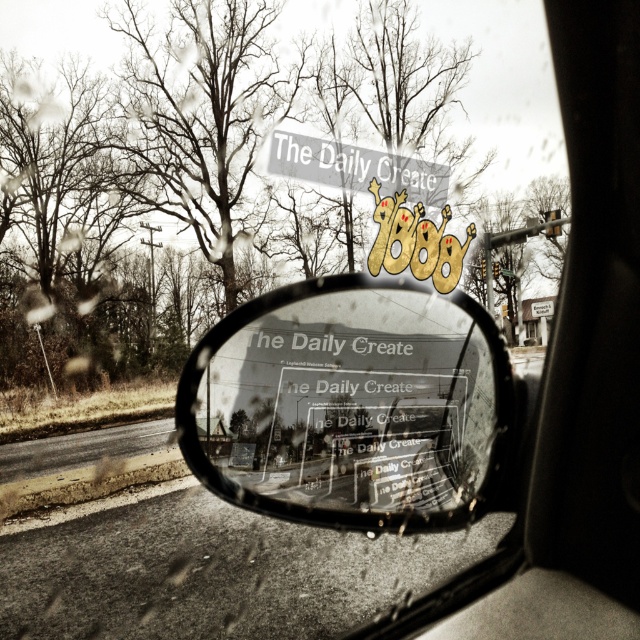
Question: Which point is farther from the camera taking this photo?

Choices:
 (A) (212, 422)
 (B) (291, 150)

Answer: (B)

Question: Is transparent glass mirror at center bigger than gray matte sign at upper center?

Choices:
 (A) no
 (B) yes

Answer: (B)

Question: Which object is farther from the camera taking this photo?

Choices:
 (A) transparent glass mirror at center
 (B) gray matte sign at upper center

Answer: (B)

Question: Which of the following is the farthest from the observer?

Choices:
 (A) transparent glass mirror at center
 (B) gray matte sign at upper center

Answer: (B)

Question: Is the position of transparent glass mirror at center less distant than that of gray matte sign at upper center?

Choices:
 (A) no
 (B) yes

Answer: (B)

Question: Where is transparent glass mirror at center located in relation to gray matte sign at upper center in the image?

Choices:
 (A) left
 (B) right

Answer: (B)